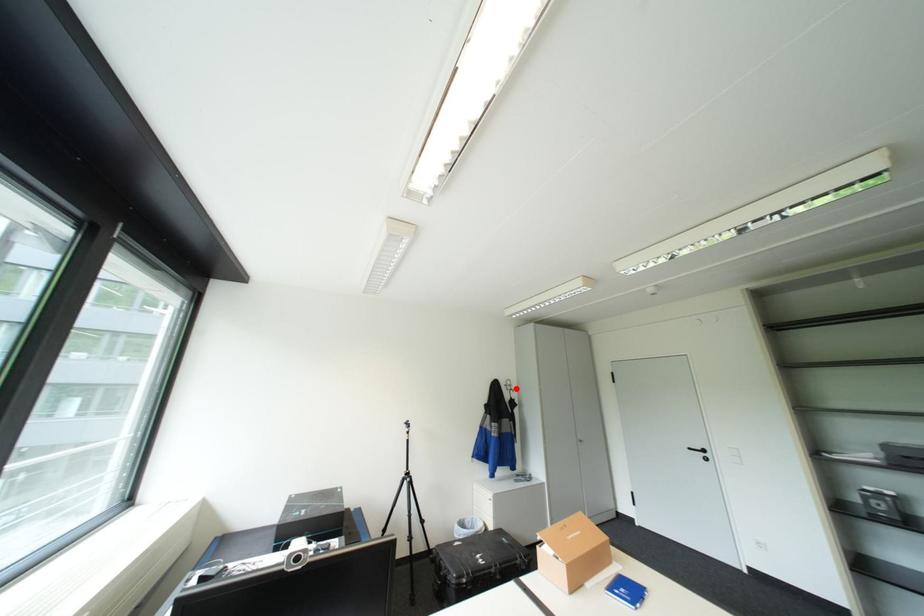
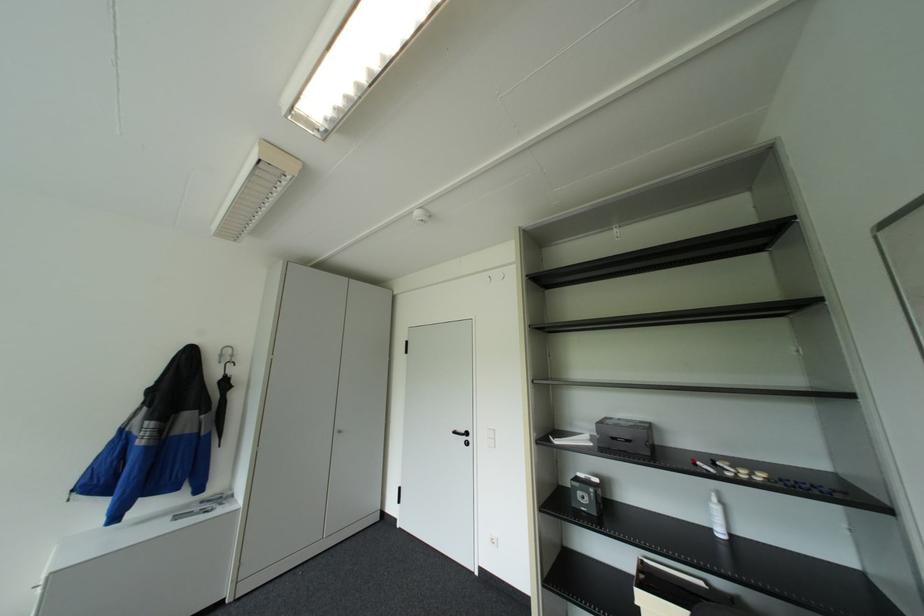
Where in the second image is the point corresponding to the highlighted location from the first image?

(227, 361)